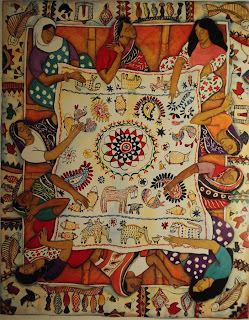
You are a GUI agent. You are given a task and a screenshot of the screen. Output one action in this format:
    pyautogui.click(x=<x>, y=<y>)
    Task: Click on the mural painting
    
    Given the screenshot: What is the action you would take?
    pyautogui.click(x=151, y=151)